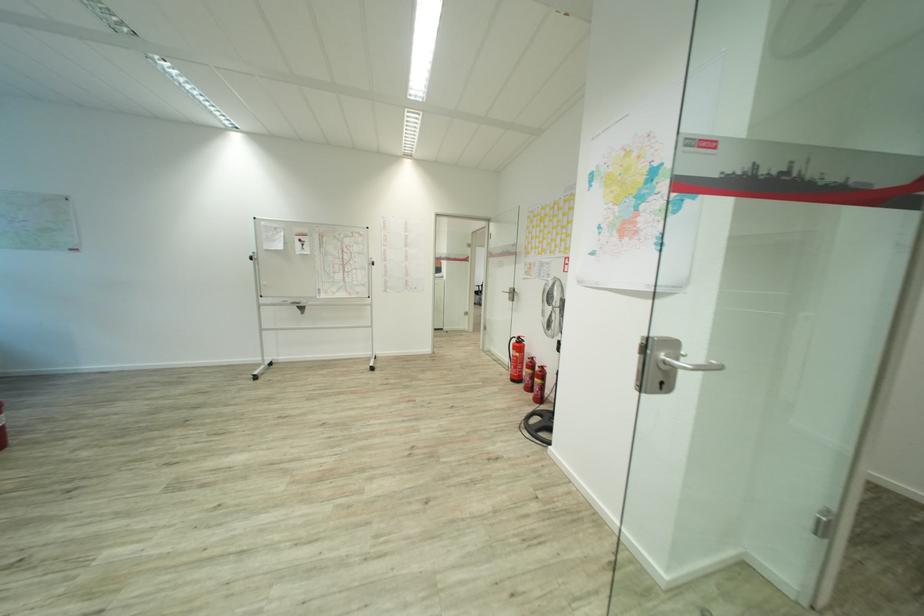
Image resolution: width=924 pixels, height=616 pixels. I want to click on fire extinguisher handle, so click(x=508, y=349).